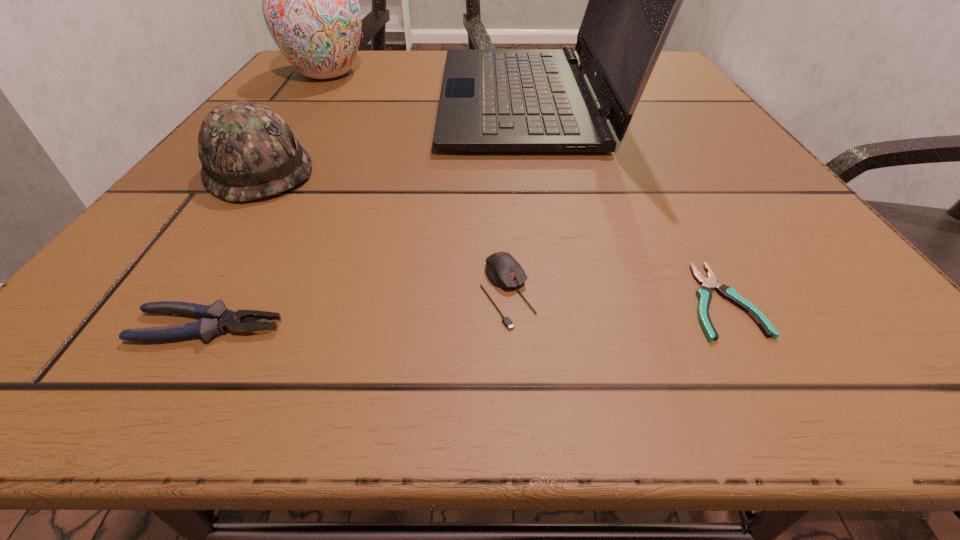
Where is `vacant space located on the screen of the laptop computer`? This screenshot has width=960, height=540. vacant space located on the screen of the laptop computer is located at coordinates (406, 99).

The width and height of the screenshot is (960, 540). In order to click on vacant region located 0.140m on the right of the fifth shortest object in this screenshot , I will do `click(434, 73)`.

At what (x,y) coordinates should I click in order to perform the action: click on free space located 0.180m on the back of the fourth shortest object. Please return your answer as a coordinate pair (x, y). Image resolution: width=960 pixels, height=540 pixels. Looking at the image, I should click on (309, 98).

Locate an element on the screen. This screenshot has height=540, width=960. vacant region located on the back of the mouse is located at coordinates (498, 145).

The image size is (960, 540). I want to click on vacant space located 0.380m at the gripping part of the left pliers, so click(655, 327).

The image size is (960, 540). What are the coordinates of `vacant space located 0.230m on the back of the right pliers` in the screenshot? It's located at (648, 165).

This screenshot has height=540, width=960. What are the coordinates of `laptop computer at the far edge` in the screenshot? It's located at (492, 100).

Find the location of a particular element. The image size is (960, 540). vase situated at the far edge is located at coordinates (310, 4).

Where is `mouse located in the near edge section of the desktop`? The height and width of the screenshot is (540, 960). mouse located in the near edge section of the desktop is located at coordinates (504, 272).

Locate an element on the screen. This screenshot has height=540, width=960. vase positioned at the left edge is located at coordinates (310, 4).